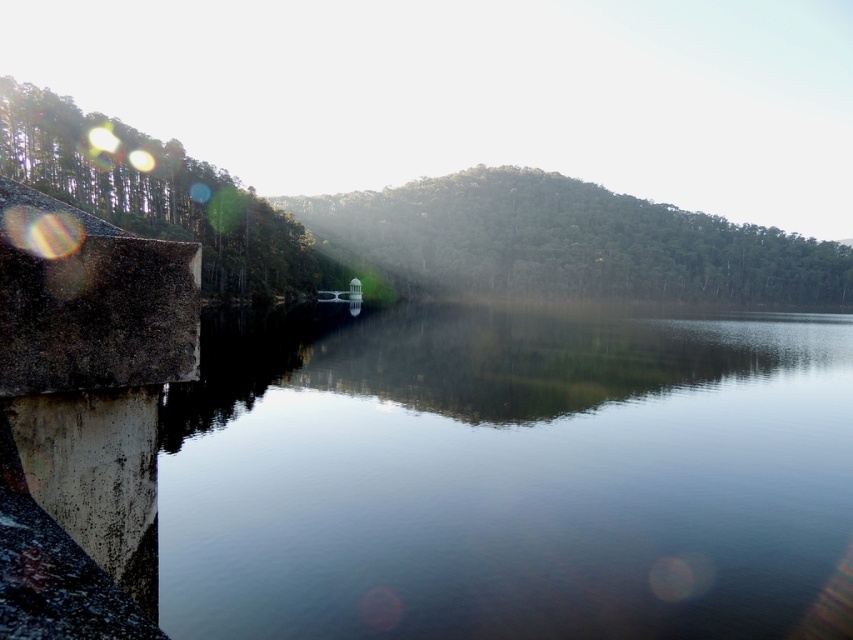
Is green textured hillside at center above green matte trees at left?

Yes.

Is green textured hillside at center bigger than green matte trees at left?

Correct, green textured hillside at center is larger in size than green matte trees at left.

Which is behind, point (576, 269) or point (16, 163)?

Point (576, 269)

Locate an element on the screen. This screenshot has width=853, height=640. green textured hillside at center is located at coordinates click(572, 241).

Which is in front, point (433, 451) or point (262, 285)?

Positioned in front is point (433, 451).

Can you confirm if clear water at center is thinner than green matte trees at left?

Incorrect, clear water at center's width is not less than green matte trees at left's.

The height and width of the screenshot is (640, 853). Find the location of `clear water at center`. clear water at center is located at coordinates (514, 481).

Between clear water at center and green textured hillside at center, which one has less height?

Standing shorter between the two is clear water at center.

Can you confirm if clear water at center is bigger than green textured hillside at center?

No.

Where is `clear water at center`? Image resolution: width=853 pixels, height=640 pixels. clear water at center is located at coordinates [514, 481].